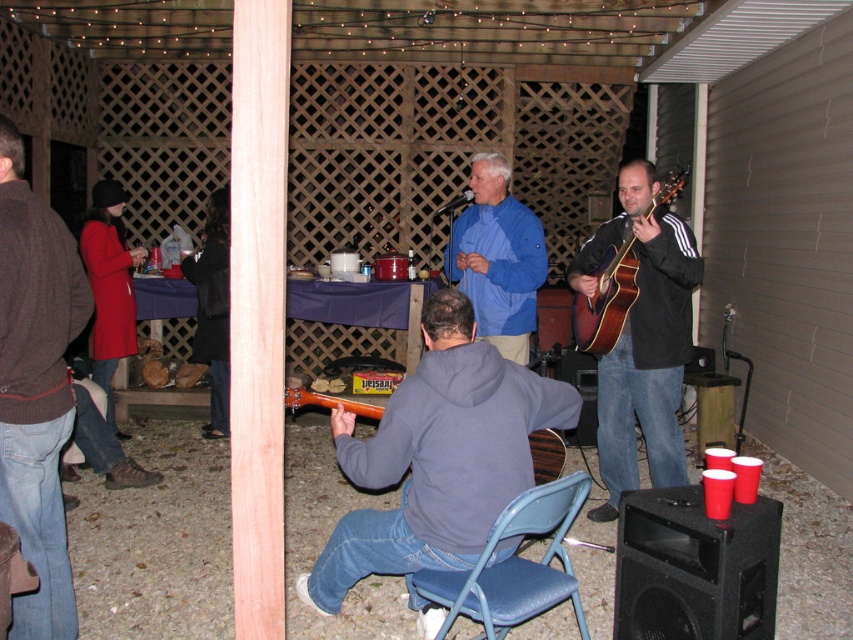
You are a photographer at the backyard party and want to capture a photo of the gray fleece hoodie at center and the matte brown guitar at right. To ensure both are in frame, should you adjust your camera to a wider angle or a narrower angle?

The gray fleece hoodie at center is positioned on the left side of matte brown guitar at right, so to capture both in frame, you should adjust your camera to a wider angle to include both objects in the shot.

You are standing at the entrance of the backyard and want to move towards the two points marked in the image. Which point, point (x=554, y=547) or point (x=503, y=262), will you reach first?

Point (x=554, y=547) is closer to the viewer than point (x=503, y=262), so you will reach point (x=554, y=547) first.

You are organizing a small outdoor concert and need to place a 3.5 feet wide amplifier between the blue matte jacket at center and the wooden acoustic guitar at center. Will there be enough space to fit the amplifier between them?

The blue matte jacket at center and wooden acoustic guitar at center are 3.44 feet apart from each other. Since the amplifier is 3.5 feet wide, there is not enough space to fit it between them as the distance is slightly less than the required width.